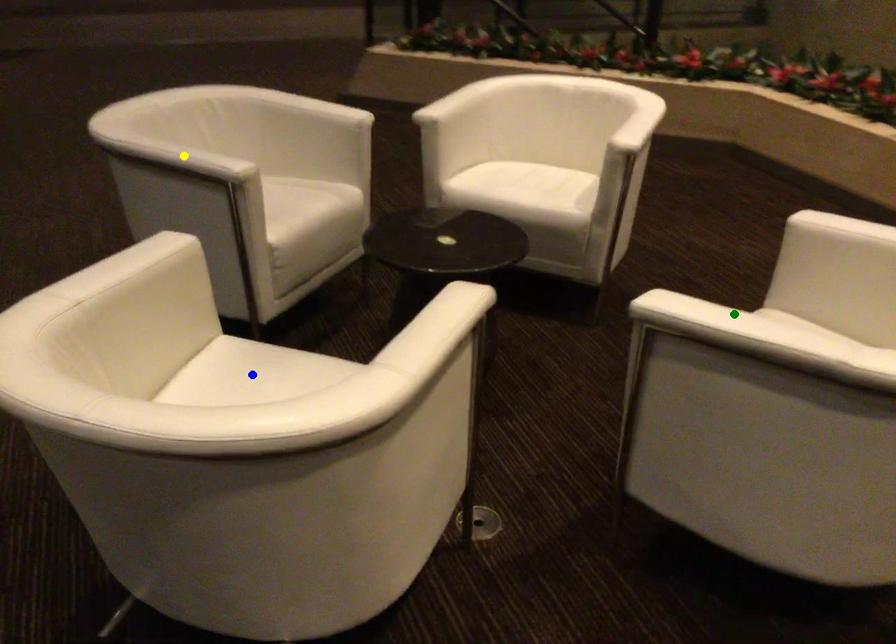
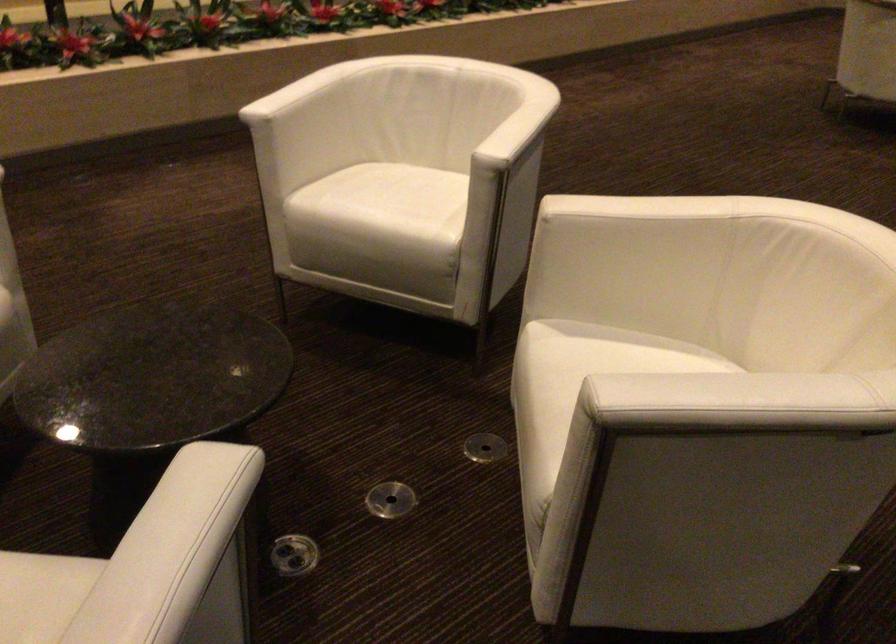
I am providing you with two images of the same scene from different viewpoints. Three points are marked in image1. Which point corresponds to a part or object that is occluded in image2?In image1, three points are marked. Which of them correspond to a part or object that is occluded in image2?Among the three points shown in image1, which one corresponds to a part or object that is no longer visible due to occlusion in image2?

Invisible in image2: blue point.